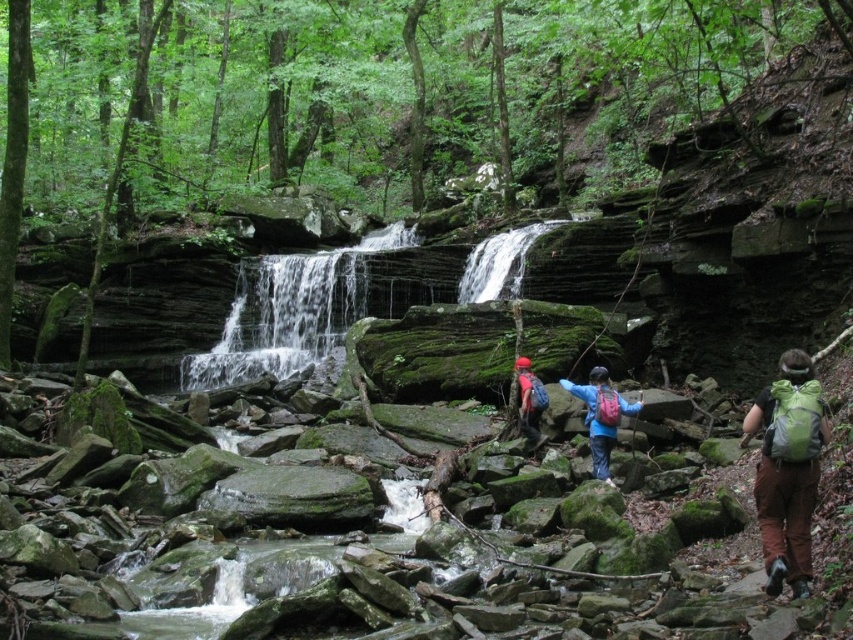
Question: Does green mossy rock at center have a lesser width compared to matte red backpack at center?

Choices:
 (A) yes
 (B) no

Answer: (B)

Question: Considering the real-world distances, which object is farthest from the blue fabric backpack at center?

Choices:
 (A) green fabric backpack at right
 (B) green mossy rock at center
 (C) matte red backpack at center

Answer: (B)

Question: Which point appears closest to the camera in this image?

Choices:
 (A) (819, 387)
 (B) (498, 250)
 (C) (532, 381)

Answer: (A)

Question: Does green mossy rock at center appear on the left side of white smooth waterfall at center?

Choices:
 (A) yes
 (B) no

Answer: (A)

Question: Which object is positioned closest to the green fabric backpack at right?

Choices:
 (A) white smooth waterfall at center
 (B) green mossy rock at center

Answer: (A)

Question: In this image, where is green mossy rock at center located relative to white smooth waterfall at center?

Choices:
 (A) right
 (B) left

Answer: (B)